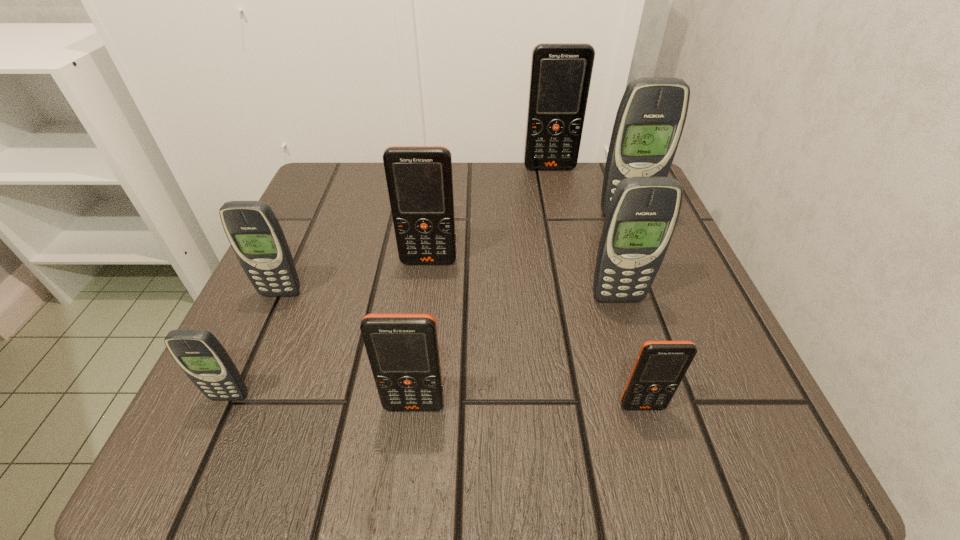
Find the location of a particular element. The height and width of the screenshot is (540, 960). the biggest orange cellular telephone is located at coordinates (560, 78).

Locate an element on the screen. The image size is (960, 540). the farthest object is located at coordinates (560, 78).

Locate an element on the screen. The width and height of the screenshot is (960, 540). the second farthest cellular telephone is located at coordinates (651, 116).

The height and width of the screenshot is (540, 960). In order to click on the second farthest object in this screenshot , I will do `click(651, 116)`.

The image size is (960, 540). What are the coordinates of `the third smallest orange cellular telephone` in the screenshot? It's located at 419,179.

Where is `the third nearest orange cellular telephone`? the third nearest orange cellular telephone is located at coordinates (419, 179).

I want to click on the second biggest gray cellular telephone, so click(642, 215).

At what (x,y) coordinates should I click in order to perform the action: click on the second smallest gray cellular telephone. Please return your answer as a coordinate pair (x, y). Looking at the image, I should click on (254, 232).

The image size is (960, 540). In order to click on the second smallest orange cellular telephone in this screenshot , I will do `click(403, 351)`.

You are a GUI agent. You are given a task and a screenshot of the screen. Output one action in this format:
    pyautogui.click(x=<x>, y=<y>)
    Task: Click on the smallest orange cellular telephone
    This screenshot has height=540, width=960.
    Given the screenshot: What is the action you would take?
    pyautogui.click(x=660, y=366)